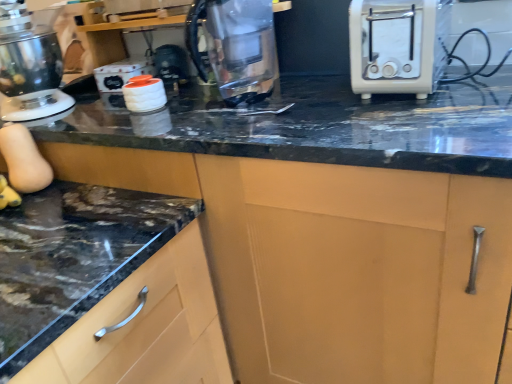
Locate an element on the screen. Image resolution: width=512 pixels, height=384 pixels. free spot in front of transparent glass kettle at center is located at coordinates (255, 122).